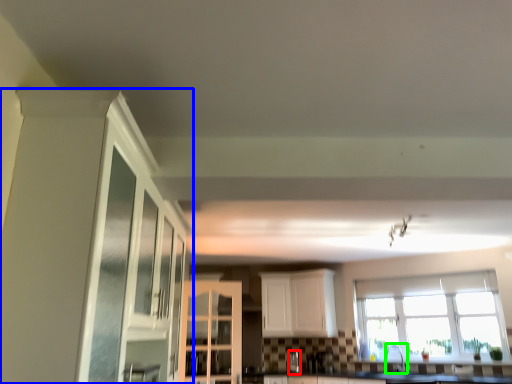
Question: Which is nearer to the silver (highlighted by a red box)? cabinetry (highlighted by a blue box) or faucet (highlighted by a green box).

Choices:
 (A) cabinetry
 (B) faucet

Answer: (B)